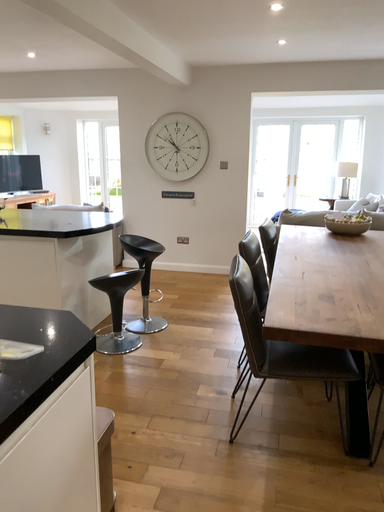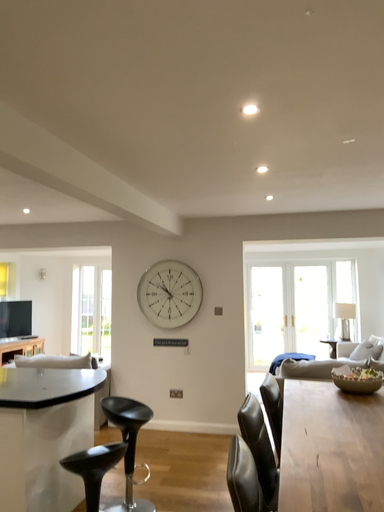
Question: Which way did the camera rotate in the video?

Choices:
 (A) rotated downward
 (B) rotated upward

Answer: (B)